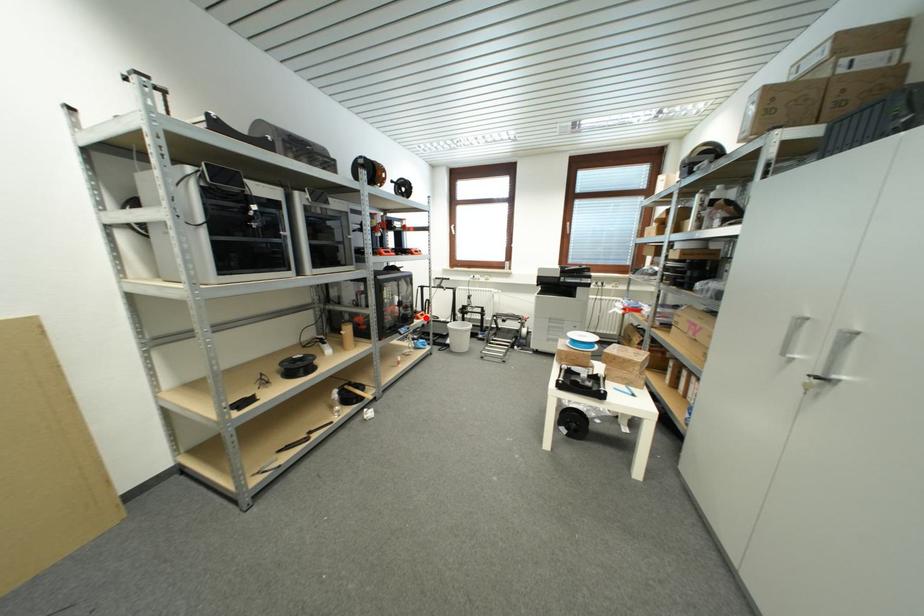
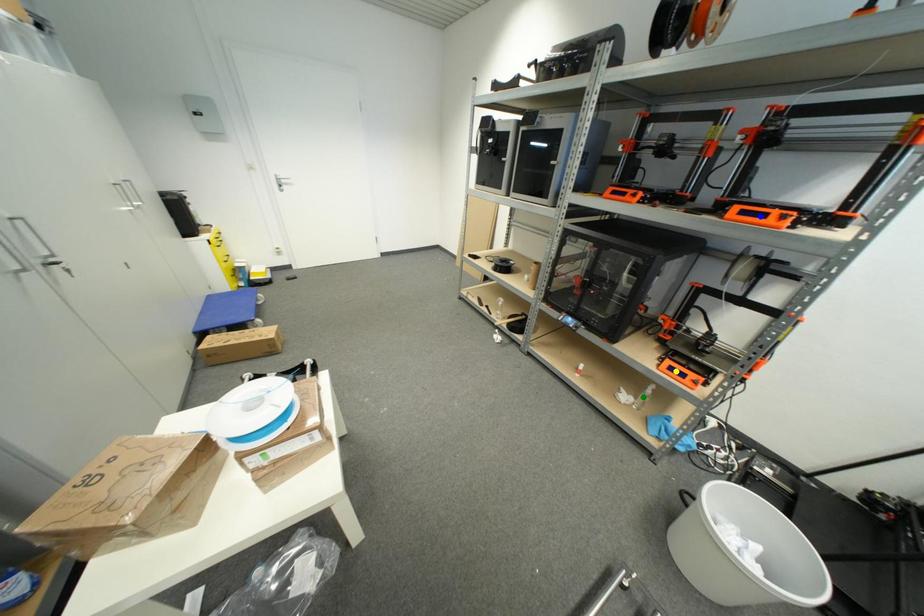
Question: I am providing you with two images of the same scene from different viewpoints. A red point is marked on the first image. You are given multiple points on the second image. In image 2, which mark is for the same physical point as the one in image 1?

Choices:
 (A) yellow point
 (B) green point
 (C) blue point

Answer: (A)